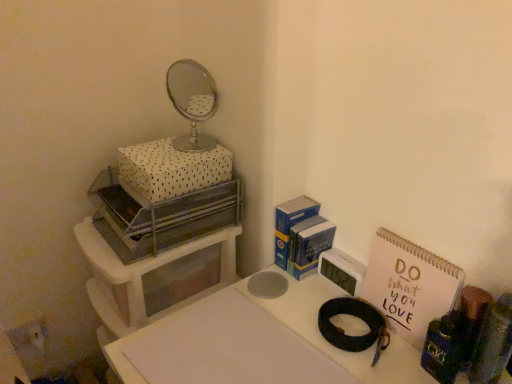
At what (x,y) coordinates should I click in order to perform the action: click on vacant region above white matte table at center (from a real-world perspective). Please return your answer as a coordinate pair (x, y). This screenshot has height=384, width=512. Looking at the image, I should click on (287, 335).